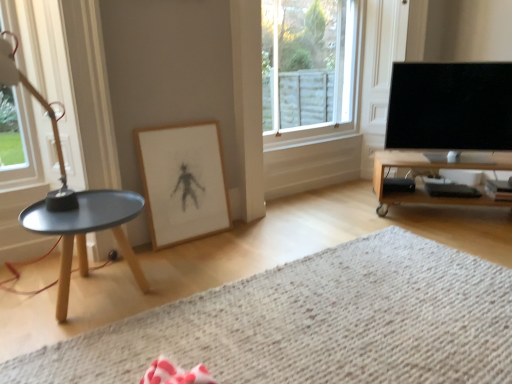
The image size is (512, 384). What do you see at coordinates (314, 323) in the screenshot? I see `white textured rug at lower center` at bounding box center [314, 323].

I want to click on wooden tv stand at right, so click(431, 169).

Find the location of a particular element. The width and height of the screenshot is (512, 384). clear glass window at left, which is counted as the first window, starting from the left is located at coordinates coord(48,69).

Based on the photo, is white textured rug at lower center oriented away from clear glass window at upper center, the first window viewed from the back?

white textured rug at lower center does not have its back to clear glass window at upper center, the first window viewed from the back.

Can you confirm if white textured rug at lower center is positioned to the right of clear glass window at upper center, marked as the 2th window in a front-to-back arrangement?

Incorrect, white textured rug at lower center is not on the right side of clear glass window at upper center, marked as the 2th window in a front-to-back arrangement.

From a real-world perspective, between white textured rug at lower center and clear glass window at upper center, the first window viewed from the back, who is vertically lower?

white textured rug at lower center is physically lower.

Between white textured rug at lower center and clear glass window at upper center, which is counted as the first window, starting from the right, which one has more height?

With more height is clear glass window at upper center, which is counted as the first window, starting from the right.

From the image's perspective, relative to clear glass window at left, positioned as the first window in front-to-back order, is wooden tv stand at right above or below?

wooden tv stand at right is situated lower than clear glass window at left, positioned as the first window in front-to-back order, in the image.

Is clear glass window at left, placed as the second window when sorted from back to front, surrounded by wooden tv stand at right?

That's incorrect, clear glass window at left, placed as the second window when sorted from back to front, is not inside wooden tv stand at right.

Does point (410, 156) come behind point (26, 148)?

Yes, point (410, 156) is farther from viewer.

From a real-world perspective, between wooden tv stand at right and clear glass window at left, placed as the second window when sorted from back to front, who is vertically lower?

wooden tv stand at right is physically lower.

From a real-world perspective, is white textured rug at lower center on top of wooden tv stand at right?

No, from a real-world perspective, white textured rug at lower center is not on top of wooden tv stand at right.

Could you tell me if white textured rug at lower center is facing wooden tv stand at right?

No, white textured rug at lower center is not facing towards wooden tv stand at right.

In terms of height, does white textured rug at lower center look taller or shorter compared to wooden tv stand at right?

Considering their sizes, white textured rug at lower center has less height than wooden tv stand at right.

You are a GUI agent. You are given a task and a screenshot of the screen. Output one action in this format:
    pyautogui.click(x=<x>, y=<y>)
    Task: Click on the television lying on the right of wooden framed drawing at center
    Image resolution: width=512 pixels, height=384 pixels.
    Given the screenshot: What is the action you would take?
    pyautogui.click(x=450, y=106)

Is point (214, 204) behind point (475, 113)?

No, it is in front of (475, 113).

From a real-world perspective, which is physically above, wooden framed drawing at center or black glossy tv at right?

black glossy tv at right.

Can you confirm if wooden framed drawing at center is positioned to the left of black glossy tv at right?

Yes.

Would you say clear glass window at left, placed as the second window when sorted from back to front, is outside wooden tv stand at right?

Yes.

Are clear glass window at left, positioned as the first window in front-to-back order, and wooden tv stand at right making contact?

No, clear glass window at left, positioned as the first window in front-to-back order, is not in contact with wooden tv stand at right.

Is point (53, 154) closer to camera compared to point (394, 153)?

Yes.

I want to click on the 1st window positioned above the wooden tv stand at right (from a real-world perspective), so click(x=48, y=69).

Could you tell me if matte black tray at left is facing clear glass window at upper center, positioned as the 2th window in left-to-right order?

No, matte black tray at left is not oriented towards clear glass window at upper center, positioned as the 2th window in left-to-right order.

Does matte black tray at left have a lesser width compared to clear glass window at upper center, positioned as the 2th window in left-to-right order?

Incorrect, the width of matte black tray at left is not less than that of clear glass window at upper center, positioned as the 2th window in left-to-right order.

In terms of size, does matte black tray at left appear bigger or smaller than clear glass window at upper center, which is counted as the first window, starting from the right?

Clearly, matte black tray at left is smaller in size than clear glass window at upper center, which is counted as the first window, starting from the right.

Is matte black tray at left shorter than clear glass window at upper center, positioned as the 2th window in left-to-right order?

Yes, matte black tray at left is shorter than clear glass window at upper center, positioned as the 2th window in left-to-right order.

Is wooden tv stand at right with black glossy tv at right?

wooden tv stand at right is not next to black glossy tv at right, and they're not touching.

From a real-world perspective, which is physically below, wooden tv stand at right or black glossy tv at right?

In real-world perspective, wooden tv stand at right is lower.

Could you tell me if wooden tv stand at right is facing black glossy tv at right?

No, wooden tv stand at right is not facing towards black glossy tv at right.

There is a white textured rug at lower center. What are the coordinates of `the 2nd window above it (from the image's perspective)` in the screenshot? It's located at (308, 64).

Identify the location of table behind the clear glass window at left, which is counted as the first window, starting from the left. The width and height of the screenshot is (512, 384). (431, 169).

Looking at the image, which one is located closer to wooden framed drawing at center, wooden tv stand at right or clear glass window at upper center, marked as the 2th window in a front-to-back arrangement?

The object closer to wooden framed drawing at center is clear glass window at upper center, marked as the 2th window in a front-to-back arrangement.

Based on their spatial positions, is black glossy tv at right or wooden framed drawing at center further from clear glass window at upper center, the first window viewed from the back?

wooden framed drawing at center is positioned further to the anchor clear glass window at upper center, the first window viewed from the back.

When comparing their distances from black glossy tv at right, does wooden tv stand at right or white textured rug at lower center seem closer?

wooden tv stand at right lies closer to black glossy tv at right than the other object.

From the image, which object appears to be nearer to clear glass window at left, which is counted as the first window, starting from the left, wooden tv stand at right or matte black tray at left?

Based on the image, matte black tray at left appears to be nearer to clear glass window at left, which is counted as the first window, starting from the left.

From the image, which object appears to be nearer to clear glass window at left, the 2th window when ordered from right to left, black glossy tv at right or white textured rug at lower center?

The object closer to clear glass window at left, the 2th window when ordered from right to left, is white textured rug at lower center.

Considering their positions, is matte black tray at left positioned further to clear glass window at upper center, the first window viewed from the back, than clear glass window at left, positioned as the first window in front-to-back order?

Based on the image, clear glass window at left, positioned as the first window in front-to-back order, appears to be further to clear glass window at upper center, the first window viewed from the back.

Estimate the real-world distances between objects in this image. Which object is further from clear glass window at upper center, which is counted as the first window, starting from the right, white textured rug at lower center or wooden tv stand at right?

Based on the image, white textured rug at lower center appears to be further to clear glass window at upper center, which is counted as the first window, starting from the right.

From the image, which object appears to be nearer to black glossy tv at right, matte black tray at left or wooden framed drawing at center?

Based on the image, wooden framed drawing at center appears to be nearer to black glossy tv at right.

Locate an element on the screen. table located between white textured rug at lower center and clear glass window at upper center, positioned as the 2th window in left-to-right order, in the depth direction is located at coordinates (431, 169).

This screenshot has height=384, width=512. In order to click on window located between matte black tray at left and wooden tv stand at right in the left-right direction in this screenshot , I will do `click(308, 64)`.

Locate an element on the screen. Image resolution: width=512 pixels, height=384 pixels. picture frame between white textured rug at lower center and black glossy tv at right along the z-axis is located at coordinates (183, 181).

Find the location of a particular element. The width and height of the screenshot is (512, 384). coffee table between clear glass window at left, the 2th window when ordered from right to left, and black glossy tv at right is located at coordinates (86, 232).